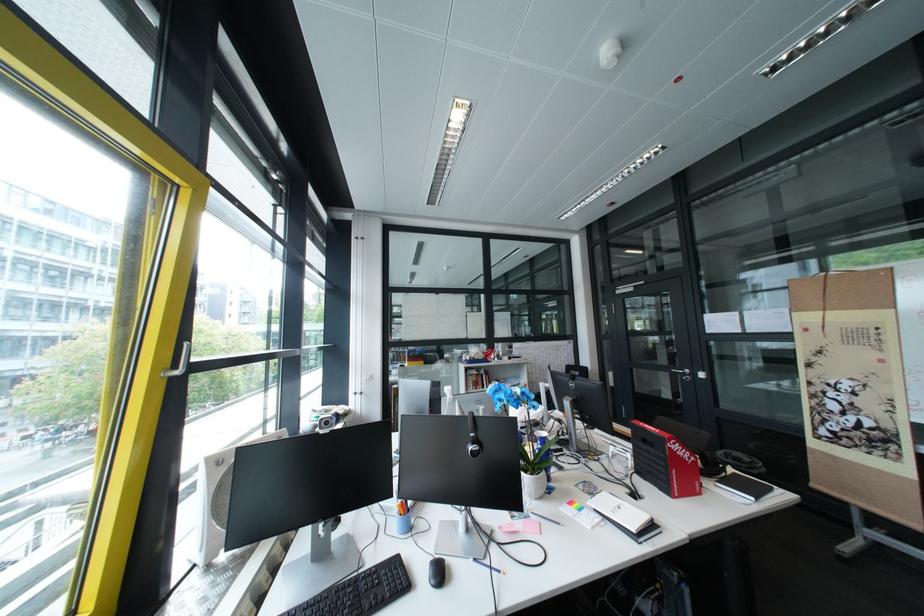
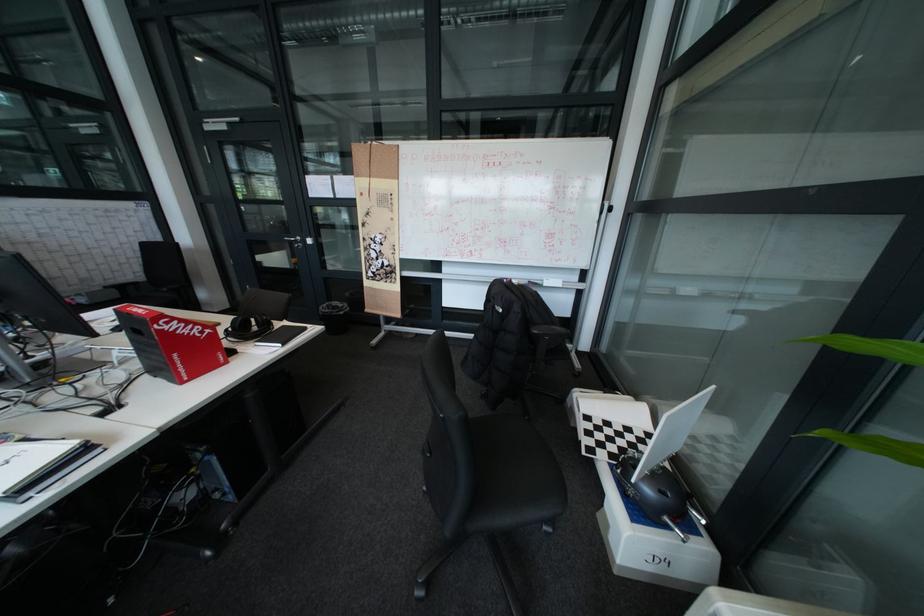
In the second image, find the point that corresponds to [650,476] in the first image.

(160, 376)